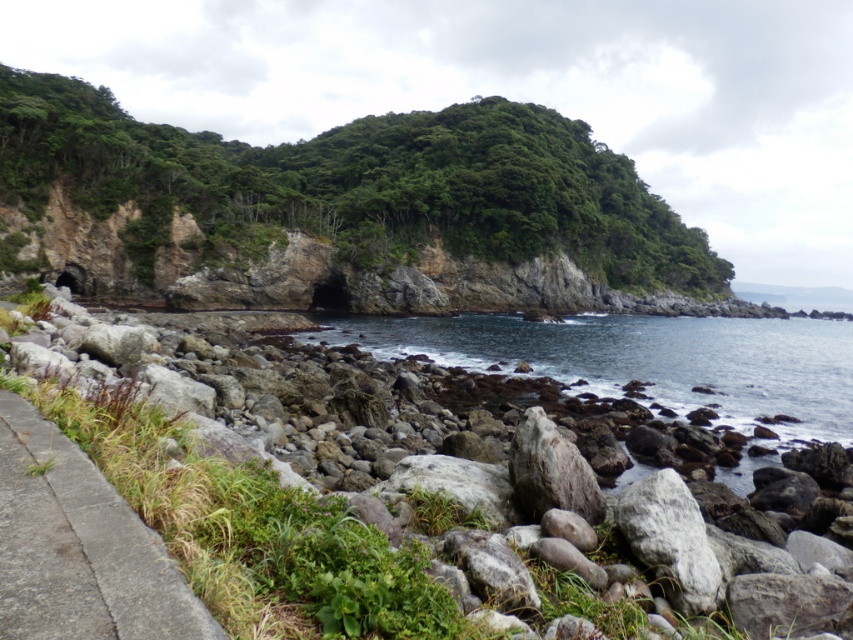
Question: Does gray rock at center have a larger size compared to dark blue water at center?

Choices:
 (A) no
 (B) yes

Answer: (A)

Question: Does rocky cliff at center appear under gray concrete path at lower left?

Choices:
 (A) yes
 (B) no

Answer: (B)

Question: Which point is farther from the camera taking this photo?

Choices:
 (A) (805, 371)
 (B) (28, 408)
 (C) (318, 474)
 (D) (20, 122)

Answer: (D)

Question: Which of these objects is positioned closest to the gray concrete path at lower left?

Choices:
 (A) rocky cliff at center
 (B) dark blue water at center
 (C) gray rock at center

Answer: (C)

Question: Does gray rock at center appear on the right side of dark blue water at center?

Choices:
 (A) no
 (B) yes

Answer: (A)

Question: Based on their relative distances, which object is farther from the gray rock at center?

Choices:
 (A) rocky cliff at center
 (B) gray concrete path at lower left

Answer: (A)